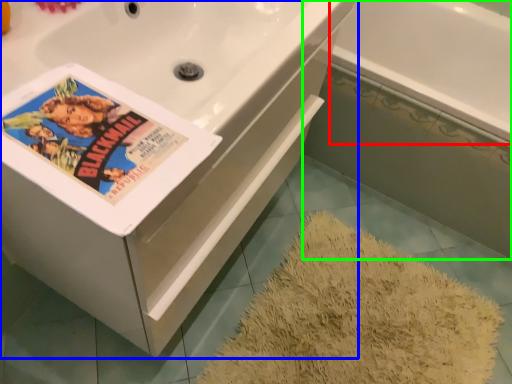
Question: Estimate the real-world distances between objects in this image. Which object is closer to bath (highlighted by a red box), bathtub (highlighted by a blue box) or bath (highlighted by a green box)?

Choices:
 (A) bathtub
 (B) bath

Answer: (B)